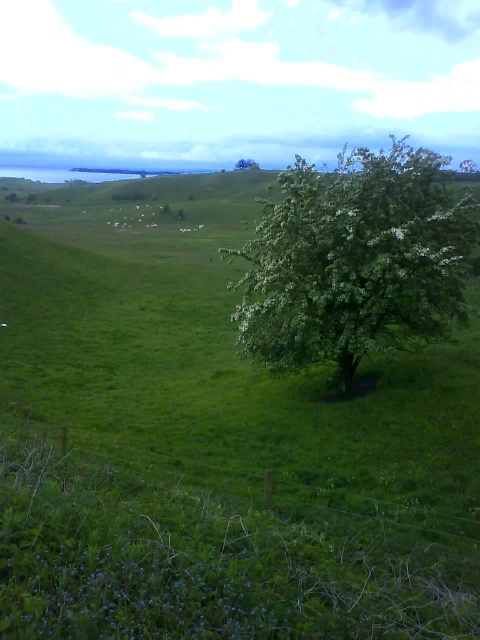
Between green leafy tree at center and green leafy tree at upper center, which one appears on the right side from the viewer's perspective?

green leafy tree at center

Does green leafy tree at center appear over green leafy tree at upper center?

No.

Between point (387, 157) and point (248, 164), which one is positioned behind?

The point (248, 164) is behind.

In order to click on green leafy tree at center in this screenshot , I will do `click(355, 260)`.